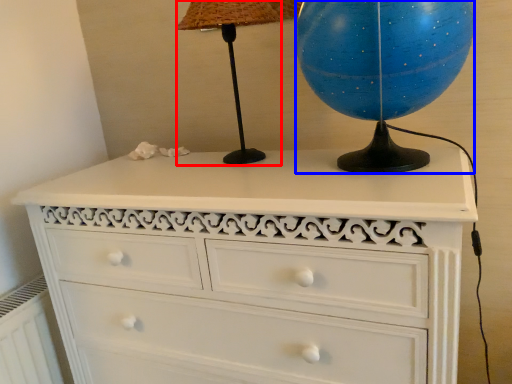
Question: Which point is further to the camera, table lamp (highlighted by a red box) or sphere (highlighted by a blue box)?

Choices:
 (A) table lamp
 (B) sphere

Answer: (A)